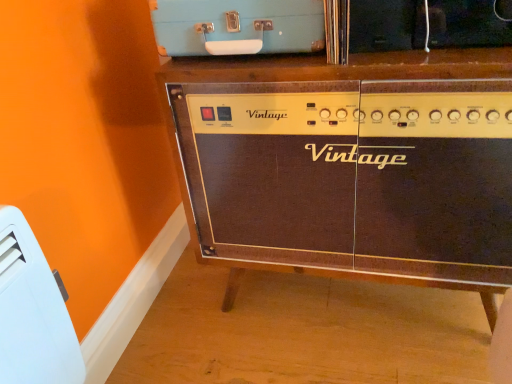
Question: Which direction should I rotate to look at light blue plastic suitcase at upper center, arranged as the first appliance when viewed from the right, — up or down?

Choices:
 (A) down
 (B) up

Answer: (B)

Question: Is brown wood cabinet at center wider than white plastic heater at lower left, the 2th appliance positioned from the right?

Choices:
 (A) no
 (B) yes

Answer: (B)

Question: Does brown wood cabinet at center have a lesser height compared to white plastic heater at lower left, the 2th appliance positioned from the right?

Choices:
 (A) yes
 (B) no

Answer: (B)

Question: Is brown wood cabinet at center far away from white plastic heater at lower left, which is the 1th appliance in left-to-right order?

Choices:
 (A) yes
 (B) no

Answer: (B)

Question: From the image's perspective, does brown wood cabinet at center appear higher than white plastic heater at lower left, placed as the 1th appliance when sorted from bottom to top?

Choices:
 (A) yes
 (B) no

Answer: (A)

Question: Considering the relative sizes of brown wood cabinet at center and white plastic heater at lower left, placed as the 1th appliance when sorted from bottom to top, in the image provided, is brown wood cabinet at center smaller than white plastic heater at lower left, placed as the 1th appliance when sorted from bottom to top,?

Choices:
 (A) no
 (B) yes

Answer: (A)

Question: From the image's perspective, is brown wood cabinet at center below white plastic heater at lower left, which is counted as the 2th appliance, starting from the top?

Choices:
 (A) no
 (B) yes

Answer: (A)

Question: Considering the relative sizes of white plastic heater at lower left, which is the 1th appliance in left-to-right order, and light blue plastic suitcase at upper center, which is counted as the 1th appliance, starting from the top, in the image provided, is white plastic heater at lower left, which is the 1th appliance in left-to-right order, shorter than light blue plastic suitcase at upper center, which is counted as the 1th appliance, starting from the top,?

Choices:
 (A) no
 (B) yes

Answer: (A)

Question: Are white plastic heater at lower left, which is the 1th appliance in left-to-right order, and light blue plastic suitcase at upper center, which is counted as the 1th appliance, starting from the top, beside each other?

Choices:
 (A) no
 (B) yes

Answer: (A)

Question: Does white plastic heater at lower left, placed as the 1th appliance when sorted from bottom to top, have a greater height compared to light blue plastic suitcase at upper center, which is counted as the 1th appliance, starting from the top?

Choices:
 (A) yes
 (B) no

Answer: (A)

Question: Does white plastic heater at lower left, placed as the 1th appliance when sorted from bottom to top, have a smaller size compared to light blue plastic suitcase at upper center, arranged as the first appliance when viewed from the right?

Choices:
 (A) yes
 (B) no

Answer: (A)

Question: Does white plastic heater at lower left, which is counted as the 2th appliance, starting from the top, appear on the right side of light blue plastic suitcase at upper center, which is counted as the 1th appliance, starting from the top?

Choices:
 (A) no
 (B) yes

Answer: (A)

Question: Is white plastic heater at lower left, which is counted as the 2th appliance, starting from the top, further to camera compared to light blue plastic suitcase at upper center, which ranks as the second appliance in bottom-to-top order?

Choices:
 (A) yes
 (B) no

Answer: (B)

Question: From the image's perspective, is white plastic heater at lower left, which is the 1th appliance in left-to-right order, beneath brown wood cabinet at center?

Choices:
 (A) yes
 (B) no

Answer: (A)